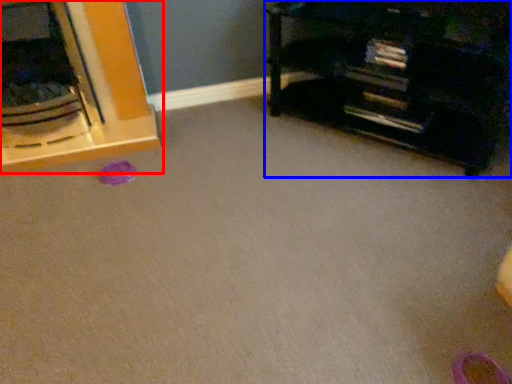
Question: Among these objects, which one is farthest to the camera, furniture (highlighted by a red box) or furniture (highlighted by a blue box)?

Choices:
 (A) furniture
 (B) furniture

Answer: (A)